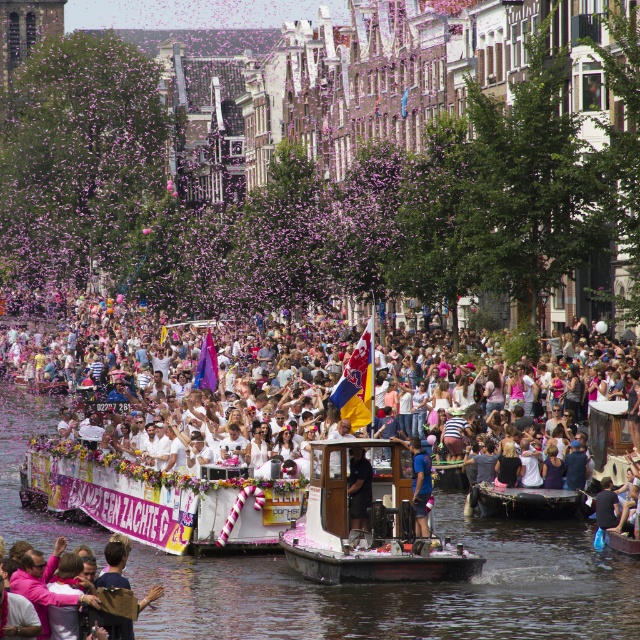
Does point (625, 636) come behind point (618, 374)?

No, (625, 636) is in front of (618, 374).

Which is in front, point (214, 604) or point (273, 413)?

Point (214, 604) is in front.

Between point (588, 536) and point (227, 356), which one is positioned in front?

Point (588, 536) is in front.

This screenshot has height=640, width=640. I want to click on transparent plastic boat at center, so click(404, 589).

Which is more to the right, pink fabric at lower left or black rubber boat at lower center?

black rubber boat at lower center

How distant is pink fabric at lower left from black rubber boat at lower center?

pink fabric at lower left and black rubber boat at lower center are 28.15 meters apart.

Measure the distance between pink fabric at lower left and camera.

The distance of pink fabric at lower left from camera is 74.18 meters.

This screenshot has height=640, width=640. Identify the location of pink fabric at lower left. (56, 580).

In the scene shown: Is black fabric person at center wider than blue fabric at center?

Incorrect, black fabric person at center's width does not surpass blue fabric at center's.

Which is behind, point (364, 467) or point (413, 442)?

The point (413, 442) is more distant.

The width and height of the screenshot is (640, 640). I want to click on black fabric person at center, so click(358, 486).